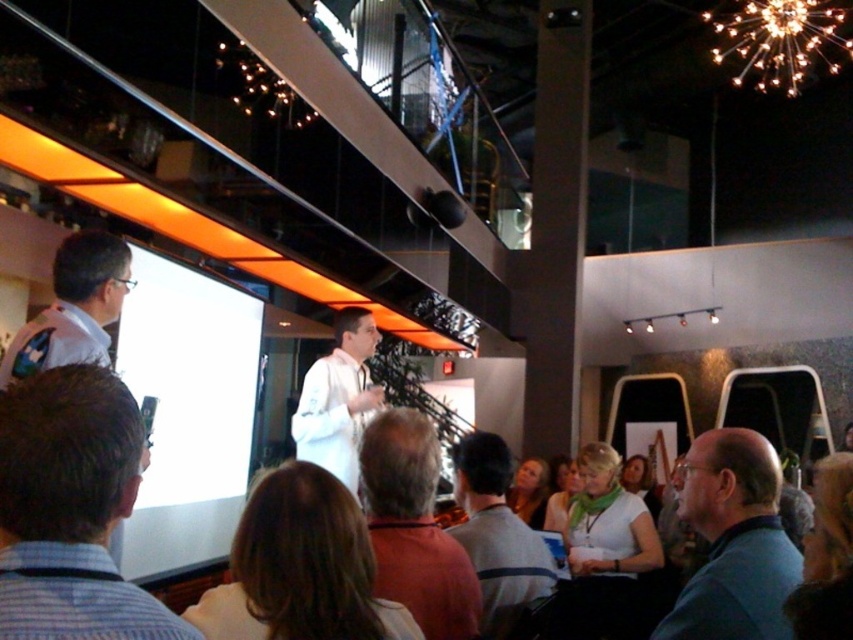
Where is `blue striped shirt at center`? This screenshot has height=640, width=853. blue striped shirt at center is located at coordinates (71, 509).

What do you see at coordinates (71, 509) in the screenshot? This screenshot has height=640, width=853. I see `blue striped shirt at center` at bounding box center [71, 509].

Locate an element on the screen. The image size is (853, 640). blue striped shirt at center is located at coordinates (71, 509).

Between point (3, 609) and point (518, 497), which one is positioned behind?

The point (518, 497) is more distant.

Is blue striped shirt at center positioned before blonde hair at center?

Yes, it is in front of blonde hair at center.

Identify the location of blue striped shirt at center. This screenshot has height=640, width=853. (71, 509).

Does blue fabric shirt at lower right come behind green fabric headscarf at lower center?

No, it is not.

Is point (676, 637) in front of point (566, 461)?

Yes, it is in front of point (566, 461).

Which is in front, point (785, 570) or point (556, 525)?

Positioned in front is point (785, 570).

Where is `blue fabric shirt at lower right`? blue fabric shirt at lower right is located at coordinates (733, 541).